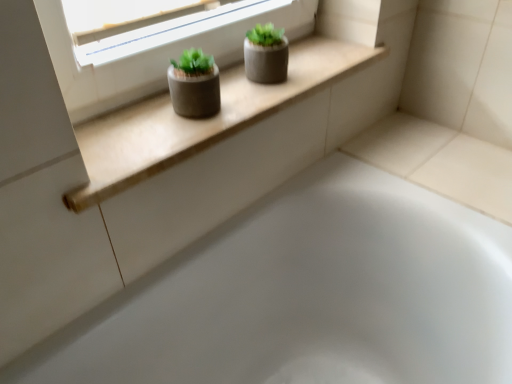
This screenshot has height=384, width=512. What do you see at coordinates (201, 120) in the screenshot?
I see `beige wood window sill at upper center` at bounding box center [201, 120].

Find the location of `beige wood window sill at upper center`. beige wood window sill at upper center is located at coordinates (201, 120).

The image size is (512, 384). What are the coordinates of `beige wood window sill at upper center` in the screenshot? It's located at (201, 120).